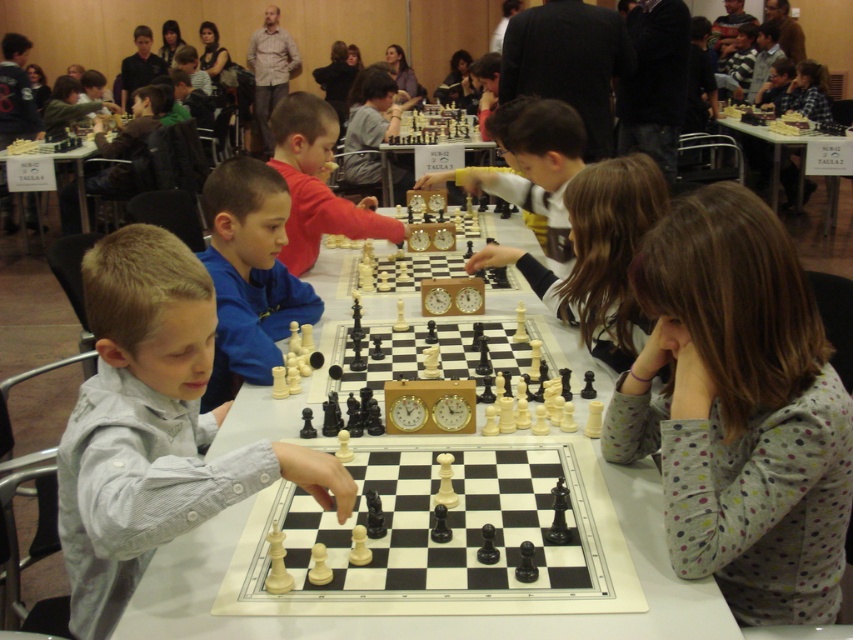
You are a photographer taking a picture of the chess tournament scene. You want to ensure both the point at point (236,353) and the point at point (277,131) are in focus. Which point should you focus on to capture both in the same plane?

You should focus on point (277,131) because it is farther from the camera than point (236,353). By focusing on the farther point, the closer point will also be within the depth of field, ensuring both are in focus.

Consider the image. You are a photographer standing at the back of the room. You want to take a photo of the gray striped shirt at center and the wooden chess clock at center. Which object will appear larger in your photo?

The gray striped shirt at center will appear larger in the photo because it is closer to the viewer than the wooden chess clock at center.